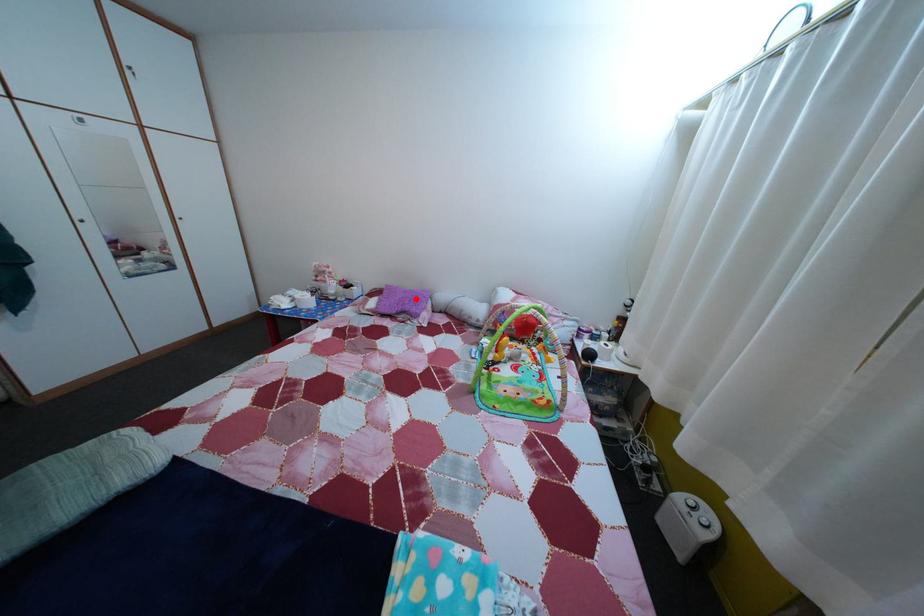
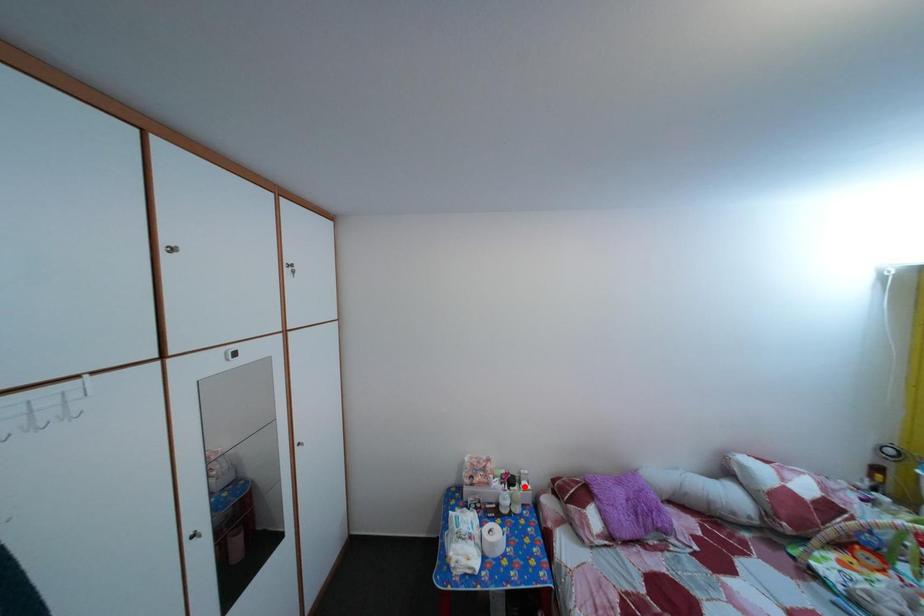
I am providing you with two images of the same scene from different viewpoints. A red point is marked on the first image and another point is marked on the second image. Do the highlighted points in image1 and image2 indicate the same real-world spot?

No